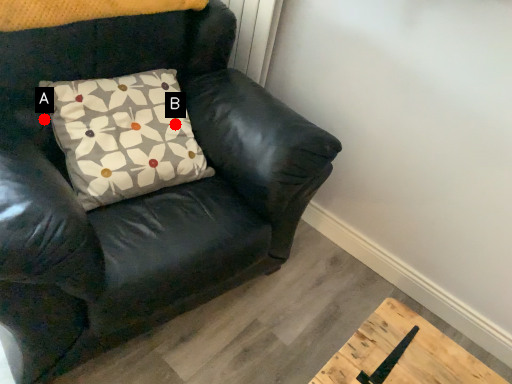
Question: Two points are circled on the image, labeled by A and B beside each circle. Among these points, which one is farthest from the camera?

Choices:
 (A) A is further
 (B) B is further

Answer: (B)